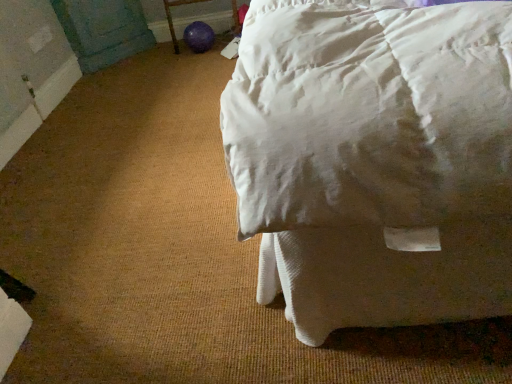
Question: Is purple rubber ball at lower center situated inside white cotton bed at upper right or outside?

Choices:
 (A) outside
 (B) inside

Answer: (A)

Question: Is purple rubber ball at lower center taller or shorter than white cotton bed at upper right?

Choices:
 (A) short
 (B) tall

Answer: (B)

Question: Visually, is purple rubber ball at lower center positioned to the left or to the right of white cotton bed at upper right?

Choices:
 (A) right
 (B) left

Answer: (B)

Question: Based on their sizes in the image, would you say white cotton bed at upper right is bigger or smaller than purple rubber ball at lower center?

Choices:
 (A) big
 (B) small

Answer: (A)

Question: Based on their positions, is white cotton bed at upper right located to the left or right of purple rubber ball at lower center?

Choices:
 (A) left
 (B) right

Answer: (B)

Question: Relative to purple rubber ball at lower center, is white cotton bed at upper right in front or behind?

Choices:
 (A) behind
 (B) front

Answer: (B)

Question: In terms of height, does white cotton bed at upper right look taller or shorter compared to purple rubber ball at lower center?

Choices:
 (A) tall
 (B) short

Answer: (B)